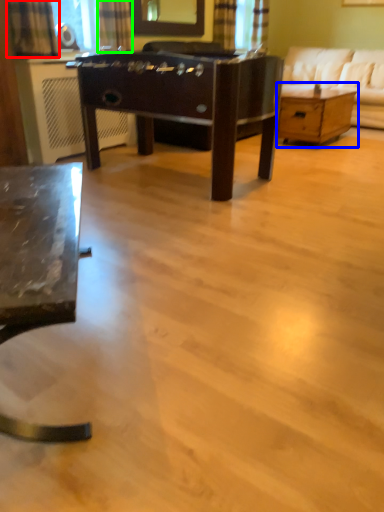
Question: Based on their relative distances, which object is nearer to curtain (highlighted by a red box)? Choose from table (highlighted by a blue box) and curtain (highlighted by a green box).

Choices:
 (A) table
 (B) curtain

Answer: (B)